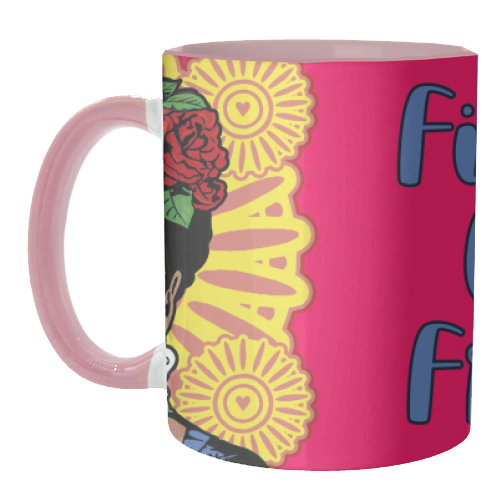
Find the location of a particular element. The width and height of the screenshot is (500, 500). mug is facing the right is located at coordinates (296, 245), (86, 364).